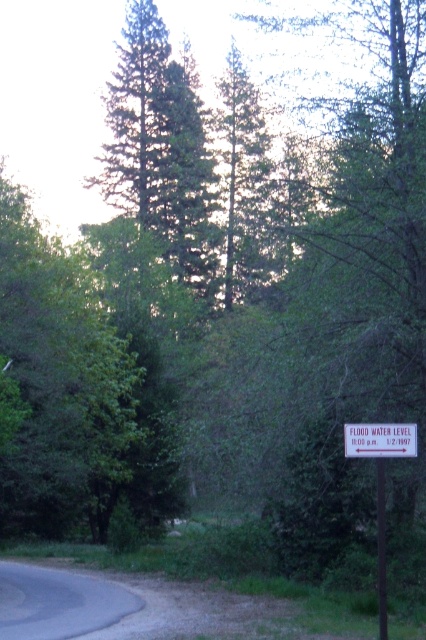
Where is `white plastic sign at lower right`? white plastic sign at lower right is located at coordinates (380, 481).

How distant is white plastic sign at lower right from metallic signpost at right?

white plastic sign at lower right and metallic signpost at right are 6.77 inches apart.

Does point (382, 444) come closer to viewer compared to point (382, 512)?

No, it is behind (382, 512).

This screenshot has height=640, width=426. In order to click on white plastic sign at lower right in this screenshot , I will do pos(380,481).